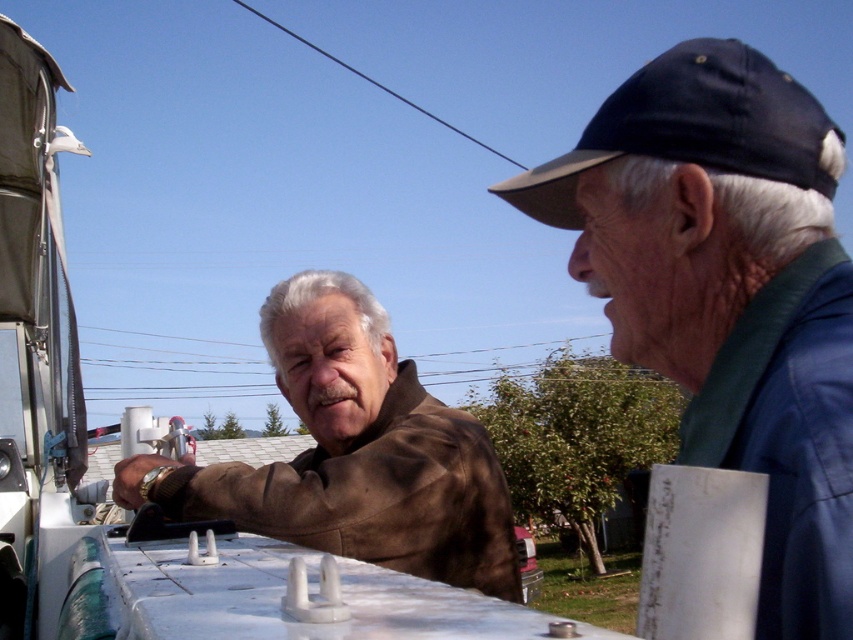
Question: Which point is farther from the camera taking this photo?

Choices:
 (A) (770, 173)
 (B) (788, 102)

Answer: (B)

Question: Does blue fabric cap at upper right have a greater width compared to navy blue fabric baseball cap at upper right?

Choices:
 (A) no
 (B) yes

Answer: (A)

Question: Can you confirm if blue fabric cap at upper right is smaller than navy blue fabric baseball cap at upper right?

Choices:
 (A) no
 (B) yes

Answer: (B)

Question: Is blue fabric cap at upper right closer to the viewer compared to navy blue fabric baseball cap at upper right?

Choices:
 (A) yes
 (B) no

Answer: (A)

Question: Which point is farther to the camera?

Choices:
 (A) (721, 129)
 (B) (755, 122)

Answer: (A)